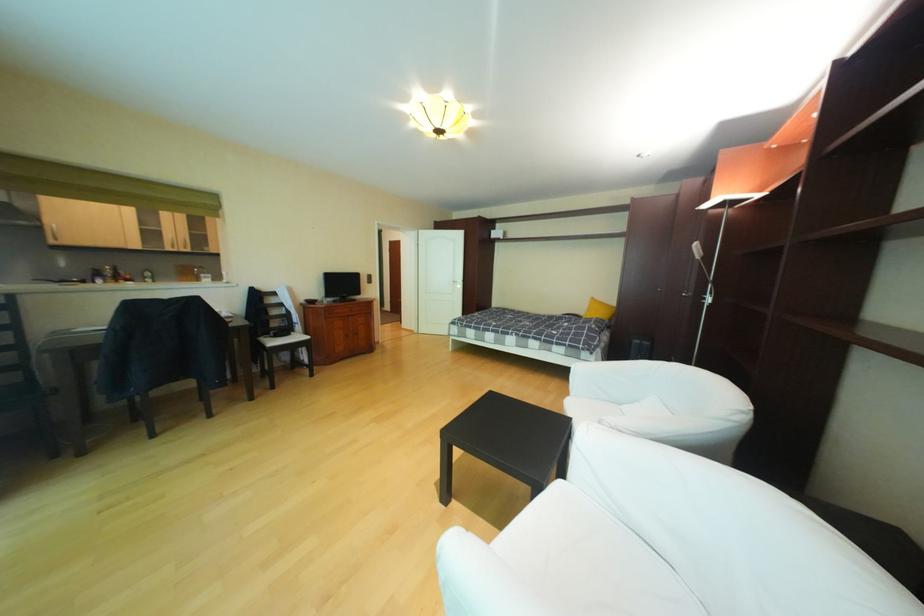
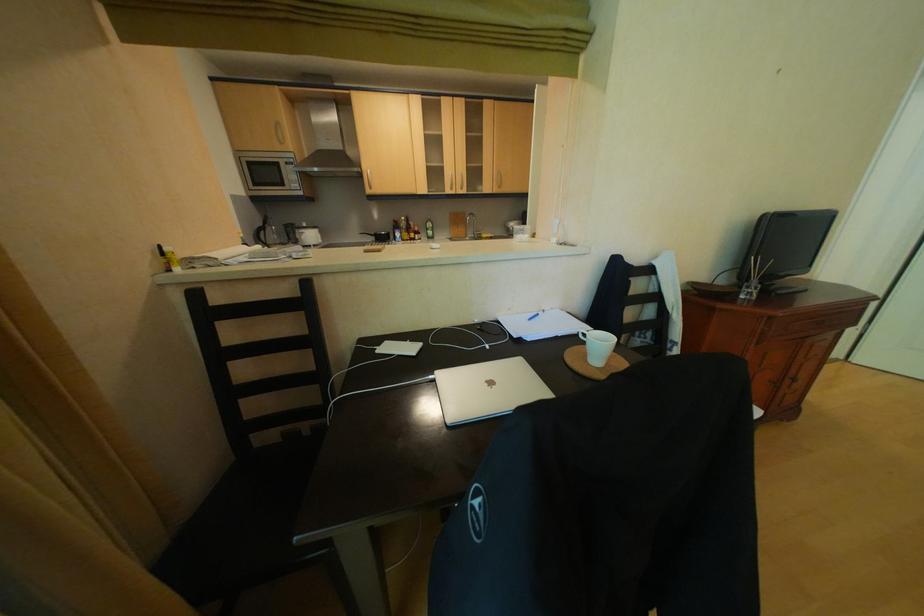
Locate, in the second image, the point that corresponds to (225,249) in the first image.

(499, 188)